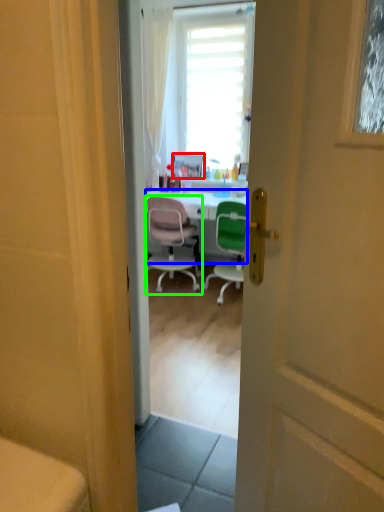
Question: Which object is the closest to the picture frame (highlighted by a red box)? Choose among these: desk (highlighted by a blue box) or chair (highlighted by a green box).

Choices:
 (A) desk
 (B) chair

Answer: (A)